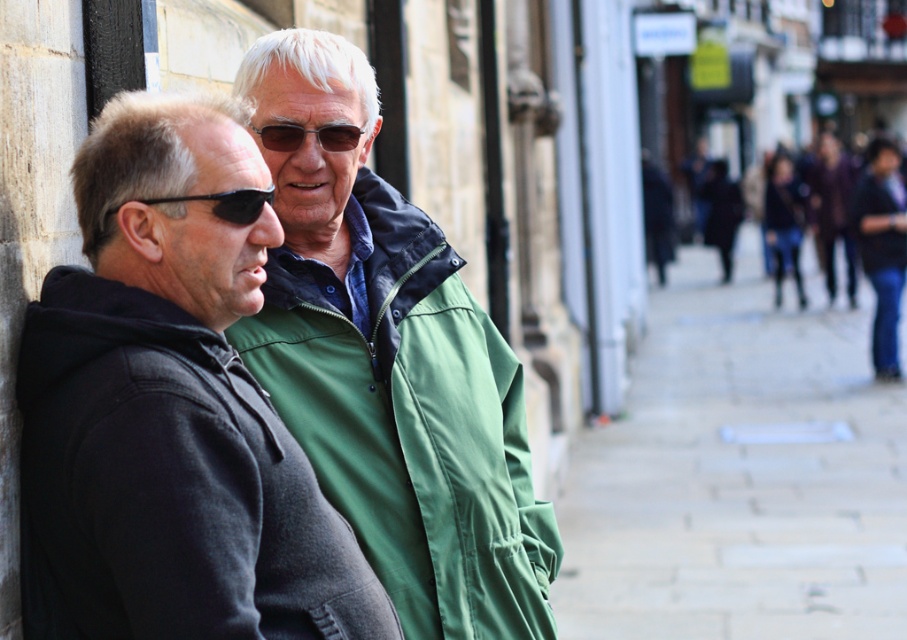
In the scene shown: You are a tailor measuring clothing items in the image. You need to determine which item, the jeans at right or the matte black sunglasses at center, requires a wider measurement for its fabric. Based on the scene, which one should you prioritize?

The jeans at right should be prioritized as its width surpasses that of the matte black sunglasses at center, meaning more fabric is needed for the jeans at right.

In the scene shown: You are a photographer standing in front of the two people in the image. You want to take a picture of both the matte black hoodie at left and the green fabric jacket at center. Which one should you adjust your camera focus on first if you want to ensure both are in focus?

Since the matte black hoodie at left is to the left of the green fabric jacket at center, you should focus on the matte black hoodie at left first as it is closer to the left edge, ensuring both are within the frame and in focus.

You are a photographer trying to capture the green fabric jacket at center and the jeans at right in a single frame. Based on their positions, which object should you focus on first to ensure both are in the frame?

The green fabric jacket at center is positioned under jeans at right, so focusing on the green fabric jacket at center first would ensure both are in the frame.